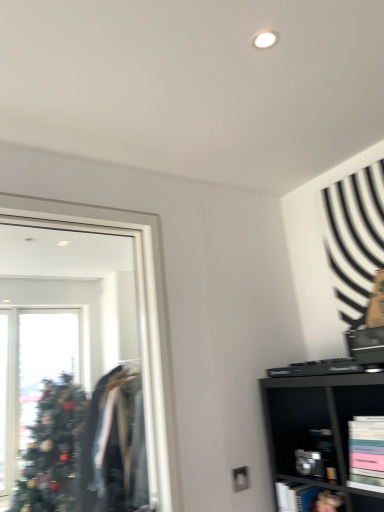
Question: Is metallic silver cabinet at lower right, the second cabinet from the front, aimed at clear glass mirror at left?

Choices:
 (A) no
 (B) yes

Answer: (A)

Question: Does metallic silver cabinet at lower right, the 1th cabinet viewed from the back, have a larger size compared to clear glass mirror at left?

Choices:
 (A) yes
 (B) no

Answer: (B)

Question: From the image's perspective, does metallic silver cabinet at lower right, the second cabinet from the front, appear lower than clear glass mirror at left?

Choices:
 (A) yes
 (B) no

Answer: (A)

Question: From a real-world perspective, is metallic silver cabinet at lower right, arranged as the 2th cabinet when viewed from the top, physically below clear glass mirror at left?

Choices:
 (A) no
 (B) yes

Answer: (B)

Question: Is the surface of metallic silver cabinet at lower right, arranged as the 2th cabinet when viewed from the top, in direct contact with clear glass mirror at left?

Choices:
 (A) no
 (B) yes

Answer: (A)

Question: Is clear glass mirror at left surrounded by metallic silver cabinet at lower right, the second cabinet from the front?

Choices:
 (A) yes
 (B) no

Answer: (B)

Question: Is matte black bookshelf at lower right, positioned as the first cabinet in front-to-back order, to the right of metallic silver cabinet at lower right, the second cabinet from the front, from the viewer's perspective?

Choices:
 (A) yes
 (B) no

Answer: (A)

Question: Is matte black bookshelf at lower right, positioned as the first cabinet in front-to-back order, completely or partially outside of metallic silver cabinet at lower right, the second cabinet from the front?

Choices:
 (A) yes
 (B) no

Answer: (A)

Question: From the image's perspective, does matte black bookshelf at lower right, acting as the 2th cabinet starting from the back, appear higher than metallic silver cabinet at lower right, marked as the first cabinet in a bottom-to-top arrangement?

Choices:
 (A) yes
 (B) no

Answer: (A)

Question: Is matte black bookshelf at lower right, acting as the 2th cabinet starting from the back, not near metallic silver cabinet at lower right, the 1th cabinet viewed from the back?

Choices:
 (A) no
 (B) yes

Answer: (A)

Question: Is matte black bookshelf at lower right, positioned as the first cabinet in front-to-back order, shorter than metallic silver cabinet at lower right, arranged as the 2th cabinet when viewed from the top?

Choices:
 (A) yes
 (B) no

Answer: (B)

Question: From the image's perspective, is matte black bookshelf at lower right, the first cabinet viewed from the top, beneath metallic silver cabinet at lower right, the second cabinet from the front?

Choices:
 (A) yes
 (B) no

Answer: (B)

Question: Does clear glass mirror at left have a larger size compared to metallic silver cabinet at lower right, the second cabinet from the front?

Choices:
 (A) no
 (B) yes

Answer: (B)